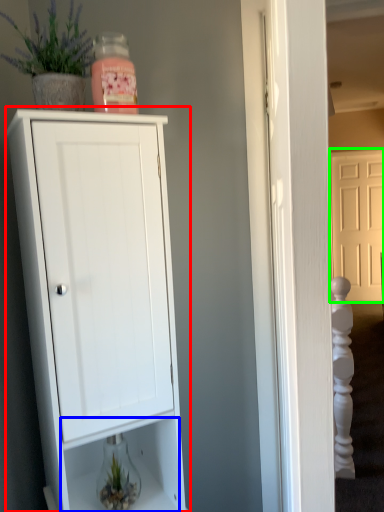
Question: Based on their relative distances, which object is nearer to cupboard (highlighted by a red box)? Choose from drawer (highlighted by a blue box) and door (highlighted by a green box).

Choices:
 (A) drawer
 (B) door

Answer: (A)